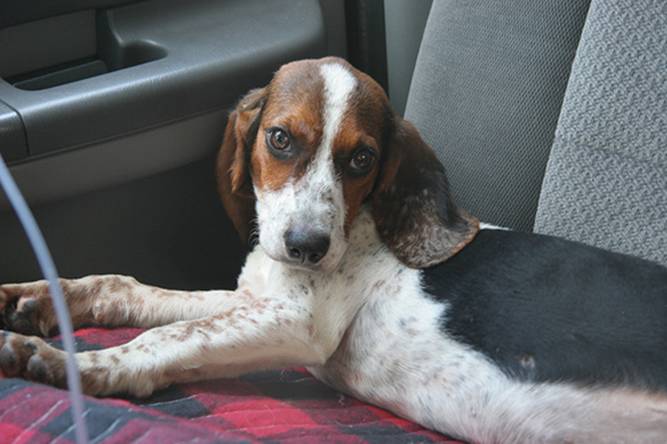
What are the coordinates of `grey cable` in the screenshot? It's located at (33, 230), (69, 354).